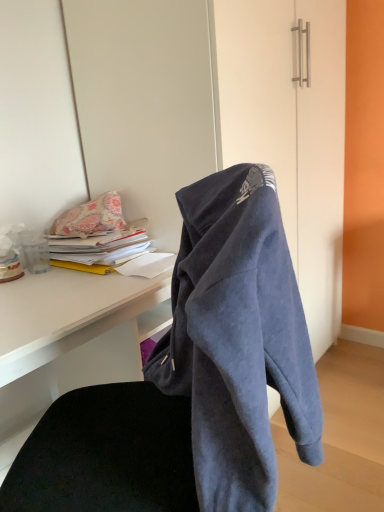
The height and width of the screenshot is (512, 384). I want to click on free space in front of yellow paper at left, so click(x=69, y=288).